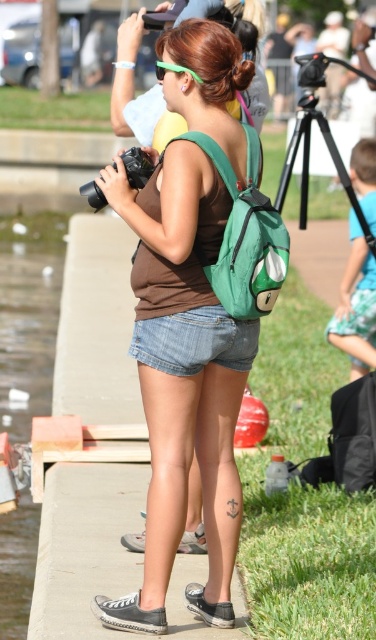
Does black rubber camera at center have a smaller size compared to gray canvas sneaker at lower center?

Actually, black rubber camera at center might be larger than gray canvas sneaker at lower center.

Can you confirm if black rubber camera at center is positioned below gray canvas sneaker at lower center?

Incorrect, black rubber camera at center is not positioned below gray canvas sneaker at lower center.

The height and width of the screenshot is (640, 376). What do you see at coordinates (136, 166) in the screenshot? I see `black rubber camera at center` at bounding box center [136, 166].

Identify the location of black rubber camera at center. The image size is (376, 640). (136, 166).

Does matte green backpack at center lie behind black rubber camera at center?

No, it is not.

Which is in front, point (144, 243) or point (136, 147)?

Point (144, 243) is more forward.

Is point (201, 316) farther from viewer compared to point (100, 205)?

No, it is in front of (100, 205).

Identify the location of matte green backpack at center. (181, 372).

Who is shorter, clear water at lower left or green plastic goggles at upper center?

clear water at lower left

Who is taller, clear water at lower left or green plastic goggles at upper center?

green plastic goggles at upper center is taller.

The image size is (376, 640). Find the location of `clear water at lower left`. clear water at lower left is located at coordinates (28, 314).